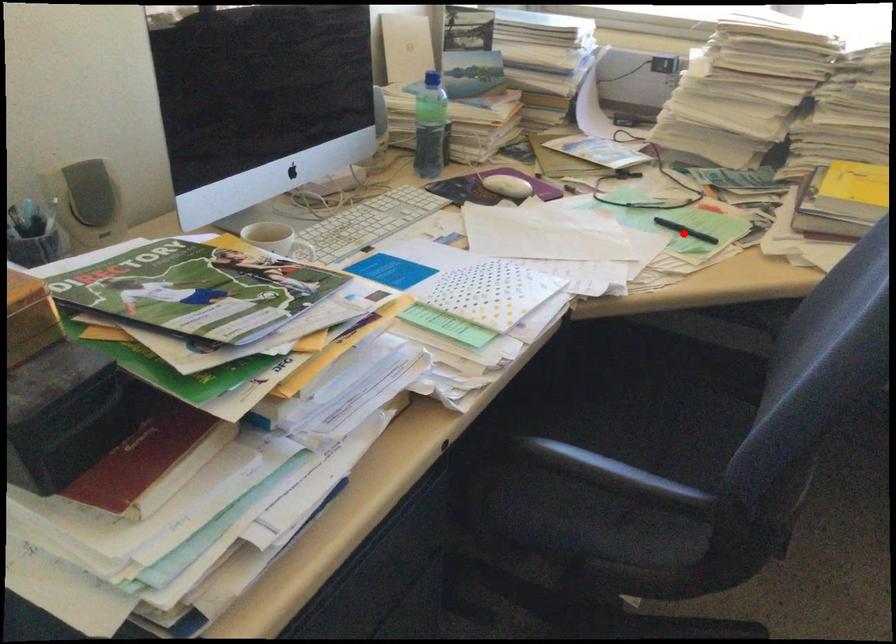
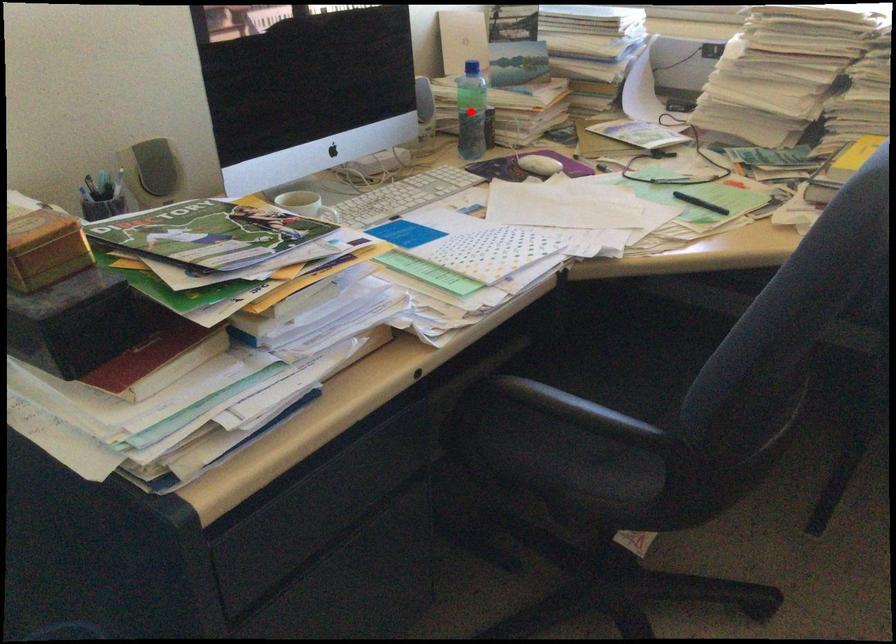
I am providing you with two images of the same scene from different viewpoints. A red point is marked on the first image and another point is marked on the second image. Do the highlighted points in image1 and image2 indicate the same real-world spot?

No